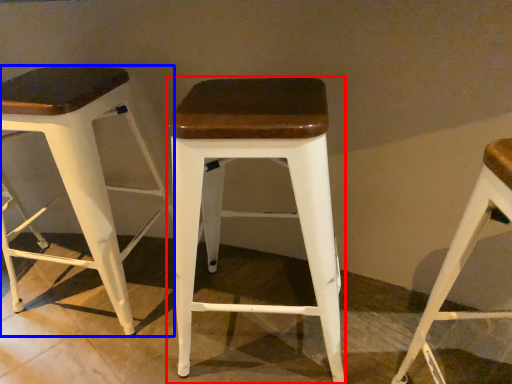
Question: Which object is further to the camera taking this photo, stool (highlighted by a red box) or stool (highlighted by a blue box)?

Choices:
 (A) stool
 (B) stool

Answer: (B)